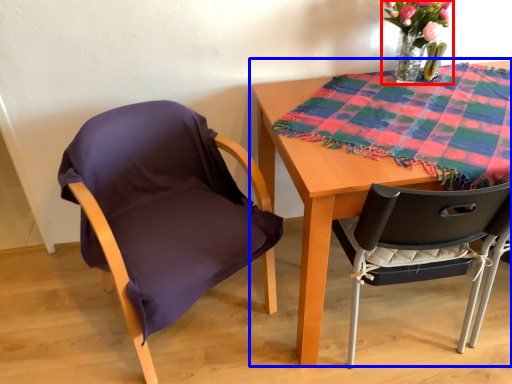
Question: Which of the following is the farthest to the observer, floral arrangement (highlighted by a red box) or table (highlighted by a blue box)?

Choices:
 (A) floral arrangement
 (B) table

Answer: (A)